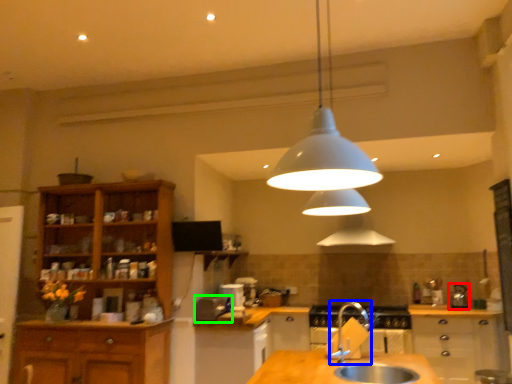
Question: Which object is positioned closest to appliance (highlighted by a red box)? Select from tap (highlighted by a blue box) and appliance (highlighted by a green box).

Choices:
 (A) tap
 (B) appliance

Answer: (B)